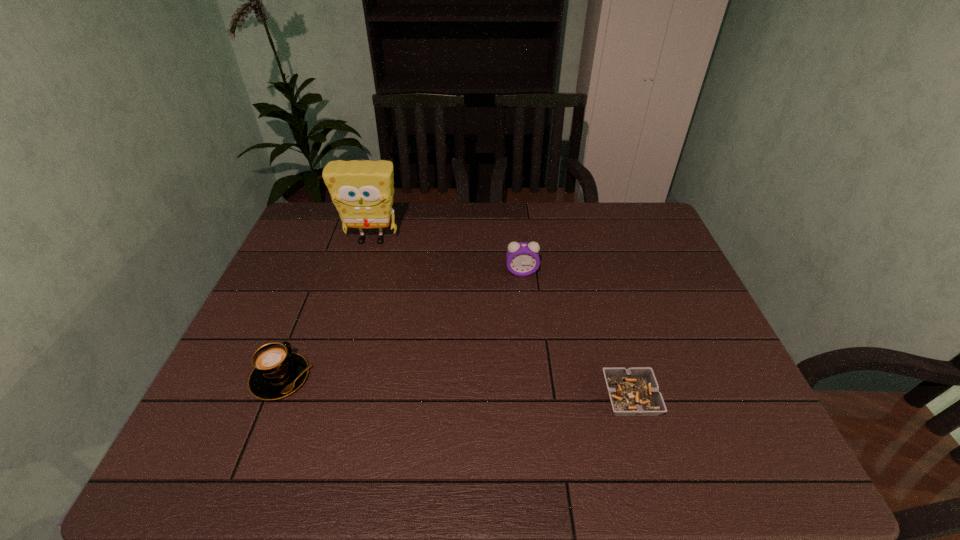
I want to click on free space located on the right of the shortest object, so click(x=691, y=397).

The image size is (960, 540). Find the location of `object that is at the far edge`. object that is at the far edge is located at coordinates (362, 191).

This screenshot has width=960, height=540. In order to click on sponge that is at the left edge in this screenshot , I will do `click(362, 191)`.

Where is `cappuccino located in the left edge section of the desktop`? This screenshot has width=960, height=540. cappuccino located in the left edge section of the desktop is located at coordinates (277, 373).

Locate an element on the screen. Image resolution: width=960 pixels, height=540 pixels. object located in the far left corner section of the desktop is located at coordinates (362, 191).

In the image, there is a desktop. Identify the location of vacant space at the far edge. (534, 202).

Image resolution: width=960 pixels, height=540 pixels. I want to click on free space at the left edge of the desktop, so click(208, 421).

The image size is (960, 540). Identify the location of vacant space at the right edge of the desktop. (700, 361).

This screenshot has height=540, width=960. Find the location of `vacant space at the far left corner of the desktop`. vacant space at the far left corner of the desktop is located at coordinates (334, 235).

Locate an element on the screen. This screenshot has height=540, width=960. vacant space at the far right corner of the desktop is located at coordinates (627, 233).